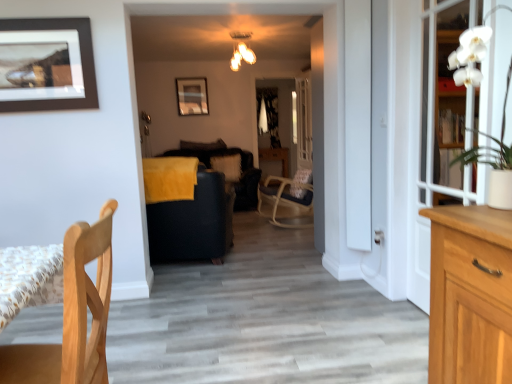
Question: In terms of width, does clear glass door at center, the 1th glass door viewed from the left, look wider or thinner when compared to white fluffy pillow at center?

Choices:
 (A) thin
 (B) wide

Answer: (A)

Question: Looking at the image, does clear glass door at center, the 1th glass door viewed from the left, seem bigger or smaller compared to white fluffy pillow at center?

Choices:
 (A) small
 (B) big

Answer: (B)

Question: Which object is the closest to the white glass door at right, which appears as the second glass door when viewed from the back?

Choices:
 (A) white fluffy pillow at center
 (B) matte black picture frame at upper center, the first picture frame when ordered from back to front
 (C) clear glass door at center, which is the 2th glass door in right-to-left order
 (D) white ceramic vase at upper right
 (E) light brown wooden chair at lower left

Answer: (D)

Question: Which of these objects is positioned closest to the light brown wooden chair at lower left?

Choices:
 (A) velvet black couch at center
 (B) white fluffy pillow at center
 (C) brown matte picture frame at upper left, which ranks as the second picture frame in back-to-front order
 (D) clear glass door at center, the 1th glass door viewed from the left
 (E) matte black picture frame at upper center, arranged as the 2th picture frame when viewed from the front

Answer: (C)